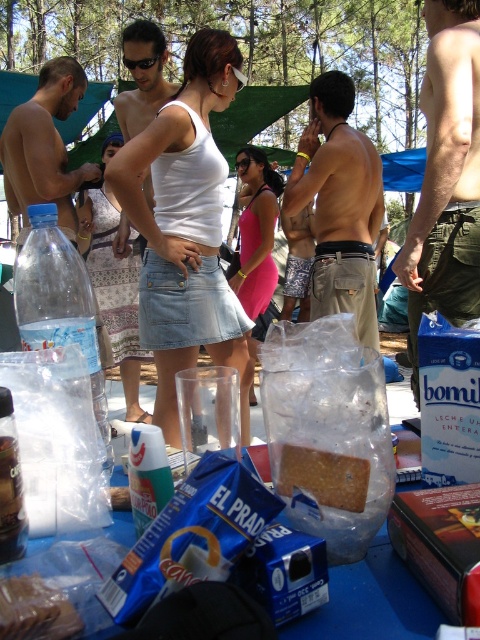
Question: Which of the following is the closest to the observer?

Choices:
 (A) black plastic goggles at center
 (B) golden textured cracker at center
 (C) brown crumbly cookie at center

Answer: (C)

Question: Which of the following is the closest to the observer?

Choices:
 (A) (334, 209)
 (B) (79, 608)
 (C) (112, 304)
 (D) (262, 310)

Answer: (B)

Question: Can you confirm if tan khaki shorts at center is positioned to the right of black plastic goggles at center?

Choices:
 (A) no
 (B) yes

Answer: (B)

Question: From the image, what is the correct spatial relationship of green canvas shorts at center in relation to brown crumbly cookie at center?

Choices:
 (A) right
 (B) left

Answer: (A)

Question: Can you confirm if white matte tank top at center is positioned below black plastic goggles at center?

Choices:
 (A) no
 (B) yes

Answer: (B)

Question: Which point is farther to the camera?

Choices:
 (A) clear plastic bottle at center
 (B) blue cardboard box at center
 (C) green canvas shorts at center

Answer: (C)